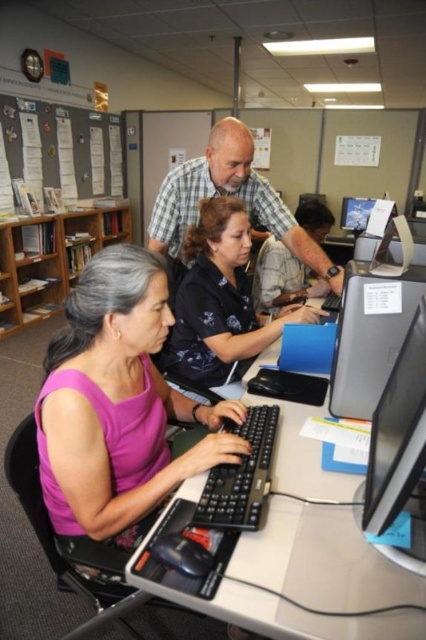
Does point (161, 492) lie behind point (385, 202)?

No, it is in front of (385, 202).

Is pink matte shirt at center further to camera compared to matte black monitor at center?

No, pink matte shirt at center is in front of matte black monitor at center.

Is point (57, 468) positioned behind point (351, 218)?

No, it is not.

Find the location of a particular element. This screenshot has width=426, height=640. pink matte shirt at center is located at coordinates (118, 404).

Does point (337, 580) come closer to viewer compared to point (34, 150)?

Yes, it is.

Between point (405, 596) and point (81, 134), which one is positioned in front?

Point (405, 596) is more forward.

Find the location of a particular element. black plastic table at lower center is located at coordinates (331, 528).

Is black satin blouse at center shorter than black matte shirt at center?

Yes.

Measure the distance between black satin blouse at center and black matte shirt at center.

black satin blouse at center is 56.53 centimeters away from black matte shirt at center.

Between point (270, 330) and point (328, 220), which one is positioned behind?

The point (328, 220) is behind.

This screenshot has width=426, height=640. In order to click on black satin blouse at center in this screenshot , I will do click(219, 301).